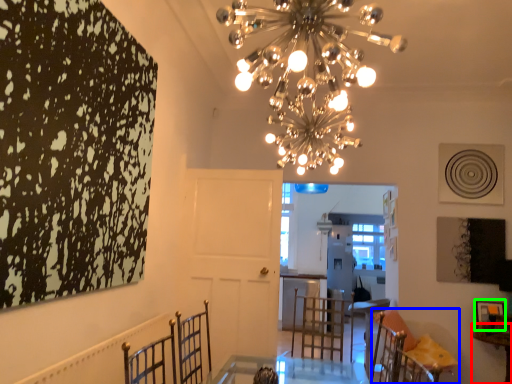
Question: Which object is positioned closest to table (highlighted by a red box)? Select from furniture (highlighted by a blue box) and picture frame (highlighted by a green box).

Choices:
 (A) furniture
 (B) picture frame

Answer: (B)